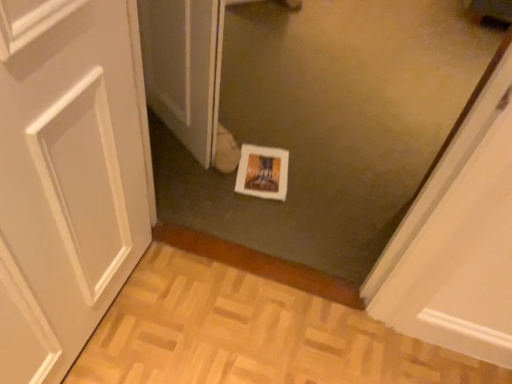
Question: Should I look upward or downward to see white glossy screen door at center?

Choices:
 (A) down
 (B) up

Answer: (B)

Question: From the image's perspective, is white glossy print at center on top of white glossy screen door at center?

Choices:
 (A) no
 (B) yes

Answer: (A)

Question: From the image's perspective, does white glossy print at center appear lower than white glossy screen door at center?

Choices:
 (A) yes
 (B) no

Answer: (A)

Question: Does white glossy print at center have a larger size compared to white glossy screen door at center?

Choices:
 (A) yes
 (B) no

Answer: (B)

Question: Is white glossy print at center at the left side of white glossy screen door at center?

Choices:
 (A) no
 (B) yes

Answer: (A)

Question: From a real-world perspective, is white glossy print at center physically below white glossy screen door at center?

Choices:
 (A) yes
 (B) no

Answer: (A)

Question: Is white glossy print at center looking in the opposite direction of white glossy screen door at center?

Choices:
 (A) yes
 (B) no

Answer: (B)

Question: Is white glossy screen door at center positioned before white glossy print at center?

Choices:
 (A) yes
 (B) no

Answer: (A)

Question: From the image's perspective, is white glossy screen door at center over white glossy print at center?

Choices:
 (A) no
 (B) yes

Answer: (B)

Question: From a real-world perspective, is white glossy screen door at center positioned over white glossy print at center based on gravity?

Choices:
 (A) no
 (B) yes

Answer: (B)

Question: Can we say white glossy screen door at center lies outside white glossy print at center?

Choices:
 (A) no
 (B) yes

Answer: (B)

Question: Does white glossy screen door at center have a lesser width compared to white glossy print at center?

Choices:
 (A) no
 (B) yes

Answer: (B)

Question: Is white glossy screen door at center at the right side of white glossy print at center?

Choices:
 (A) no
 (B) yes

Answer: (A)

Question: From a real-world perspective, is white glossy screen door at center above or below white glossy print at center?

Choices:
 (A) below
 (B) above

Answer: (B)